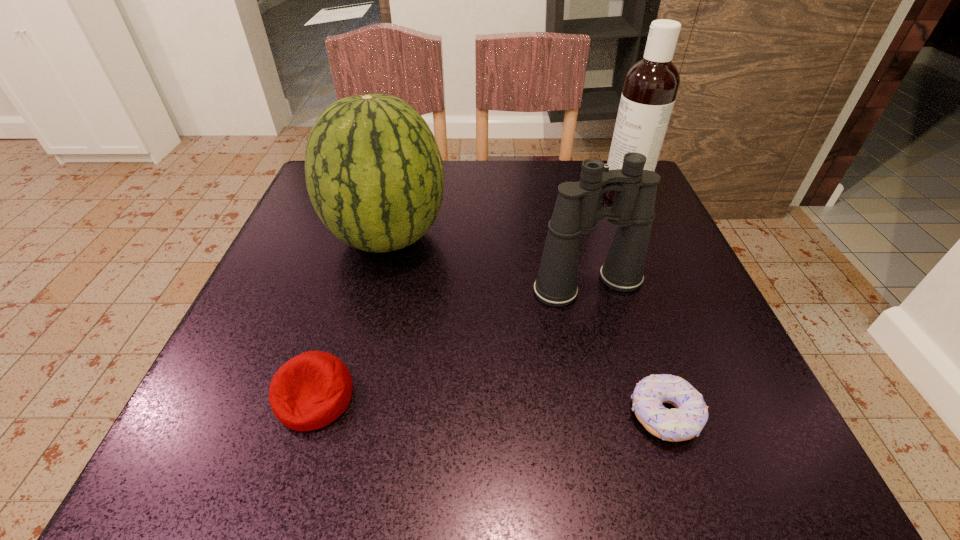
Locate an element on the screen. free region that satisfies the following two spatial constraints: 1. on the label side of the dishwasher detergent; 2. on the front side of the binoculars is located at coordinates (663, 285).

Identify the location of free location that satisfies the following two spatial constraints: 1. on the label side of the dishwasher detergent; 2. on the seat area of the fourth tallest object. (712, 397).

I want to click on vacant area that satisfies the following two spatial constraints: 1. on the label side of the tallest object; 2. on the seat area of the beanbag, so click(x=712, y=397).

Locate an element on the screen. vacant space that satisfies the following two spatial constraints: 1. on the label side of the dishwasher detergent; 2. on the front side of the watermelon is located at coordinates (642, 237).

Locate an element on the screen. Image resolution: width=960 pixels, height=540 pixels. free location that satisfies the following two spatial constraints: 1. on the label side of the dishwasher detergent; 2. on the front side of the shortest object is located at coordinates (721, 415).